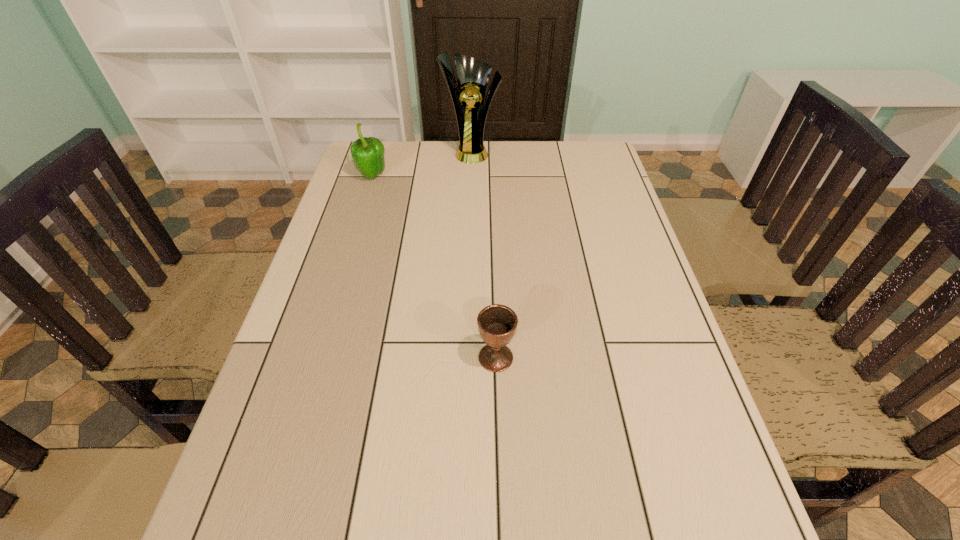
Identify the location of vacant point located between the shortest object and the farthest object. The height and width of the screenshot is (540, 960). 484,254.

Image resolution: width=960 pixels, height=540 pixels. Find the location of `unoccupied position between the award and the leftmost object`. unoccupied position between the award and the leftmost object is located at coordinates (422, 164).

Locate an element on the screen. The width and height of the screenshot is (960, 540). free space between the chalice and the second farthest object is located at coordinates (434, 267).

Locate an element on the screen. vacant region between the award and the second nearest object is located at coordinates (422, 164).

Locate an element on the screen. empty location between the bell pepper and the award is located at coordinates (422, 164).

Locate an element on the screen. The height and width of the screenshot is (540, 960). free space between the shortest object and the bell pepper is located at coordinates (434, 267).

At what (x,y) coordinates should I click in order to perform the action: click on free space between the chalice and the bell pepper. Please return your answer as a coordinate pair (x, y). The height and width of the screenshot is (540, 960). Looking at the image, I should click on (434, 267).

What are the coordinates of `vacant space that's between the leftmost object and the award` in the screenshot? It's located at (422, 164).

What are the coordinates of `the closest object relative to the farthest object` in the screenshot? It's located at (367, 153).

Locate which object ranks second in proximity to the tallest object. Please provide its 2D coordinates. Your answer should be formatted as a tuple, i.e. [(x, y)], where the tuple contains the x and y coordinates of a point satisfying the conditions above.

[(497, 324)]